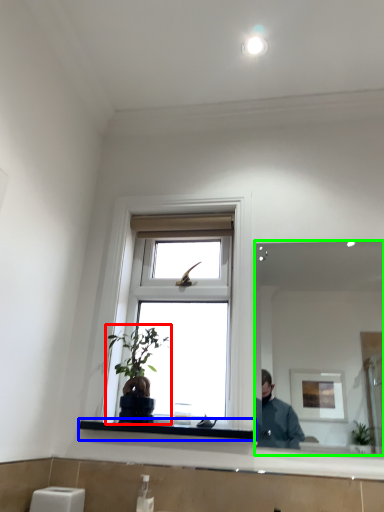
Question: Considering the real-world distances, which object is farthest from houseplant (highlighted by a red box)? window sill (highlighted by a blue box) or mirror (highlighted by a green box)?

Choices:
 (A) window sill
 (B) mirror

Answer: (B)